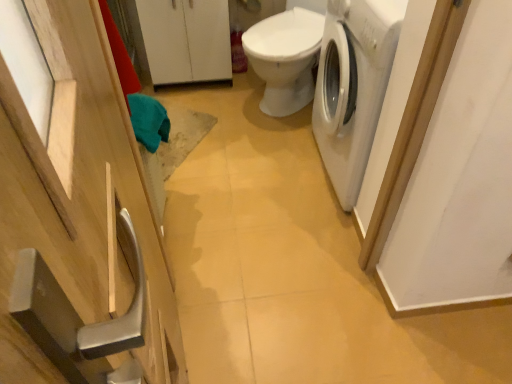
Question: From a real-world perspective, is white matte washing machine at right over white matte cabinet at upper center, positioned as the 2th cabinetry in front-to-back order?

Choices:
 (A) no
 (B) yes

Answer: (B)

Question: From the image's perspective, would you say white matte washing machine at right is positioned over white matte cabinet at upper center, arranged as the first cabinetry when viewed from the back?

Choices:
 (A) yes
 (B) no

Answer: (B)

Question: Is white matte washing machine at right taller than white matte cabinet at upper center, positioned as the 2th cabinetry in front-to-back order?

Choices:
 (A) no
 (B) yes

Answer: (B)

Question: From a real-world perspective, is white matte washing machine at right under white matte cabinet at upper center, arranged as the first cabinetry when viewed from the back?

Choices:
 (A) no
 (B) yes

Answer: (A)

Question: Can you confirm if white matte washing machine at right is wider than white matte cabinet at upper center, placed as the first cabinetry when sorted from top to bottom?

Choices:
 (A) no
 (B) yes

Answer: (B)

Question: From the image's perspective, is natural wood cabinet at left, the first cabinetry positioned from the front, positioned above or below white glossy toilet at center?

Choices:
 (A) above
 (B) below

Answer: (B)

Question: Visually, is natural wood cabinet at left, the 1th cabinetry in the bottom-to-top sequence, positioned to the left or to the right of white glossy toilet at center?

Choices:
 (A) right
 (B) left

Answer: (B)

Question: Is natural wood cabinet at left, the 1th cabinetry in the bottom-to-top sequence, bigger or smaller than white glossy toilet at center?

Choices:
 (A) big
 (B) small

Answer: (B)

Question: Looking at their shapes, would you say natural wood cabinet at left, the first cabinetry positioned from the front, is wider or thinner than white glossy toilet at center?

Choices:
 (A) thin
 (B) wide

Answer: (A)

Question: Based on their sizes in the image, would you say white matte cabinet at upper center, the 2th cabinetry from the bottom, is bigger or smaller than white glossy toilet at center?

Choices:
 (A) small
 (B) big

Answer: (A)

Question: Is white matte cabinet at upper center, positioned as the 2th cabinetry in front-to-back order, situated inside white glossy toilet at center or outside?

Choices:
 (A) inside
 (B) outside

Answer: (B)

Question: From a real-world perspective, relative to white glossy toilet at center, is white matte cabinet at upper center, the 2th cabinetry from the bottom, vertically above or below?

Choices:
 (A) below
 (B) above

Answer: (A)

Question: In the image, is white matte cabinet at upper center, placed as the first cabinetry when sorted from top to bottom, positioned in front of or behind white glossy toilet at center?

Choices:
 (A) front
 (B) behind

Answer: (B)

Question: From the image's perspective, relative to white matte cabinet at upper center, arranged as the first cabinetry when viewed from the back, is white glossy toilet at center above or below?

Choices:
 (A) above
 (B) below

Answer: (B)

Question: Is white glossy toilet at center bigger or smaller than white matte cabinet at upper center, placed as the first cabinetry when sorted from top to bottom?

Choices:
 (A) small
 (B) big

Answer: (B)